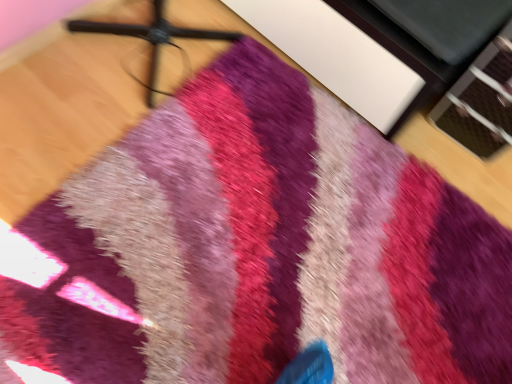
Question: Choose the correct answer: Is white matte cabinet at upper center inside black plastic tripod at upper center or outside it?

Choices:
 (A) inside
 (B) outside

Answer: (B)

Question: From a real-world perspective, relative to black plastic tripod at upper center, is white matte cabinet at upper center vertically above or below?

Choices:
 (A) above
 (B) below

Answer: (B)

Question: Would you say white matte cabinet at upper center is to the left or to the right of black plastic tripod at upper center in the picture?

Choices:
 (A) left
 (B) right

Answer: (B)

Question: In terms of height, does black plastic tripod at upper center look taller or shorter compared to white matte cabinet at upper center?

Choices:
 (A) short
 (B) tall

Answer: (B)

Question: Relative to white matte cabinet at upper center, is black plastic tripod at upper center in front or behind?

Choices:
 (A) front
 (B) behind

Answer: (A)

Question: From a real-world perspective, relative to white matte cabinet at upper center, is black plastic tripod at upper center vertically above or below?

Choices:
 (A) above
 (B) below

Answer: (A)

Question: In terms of width, does black plastic tripod at upper center look wider or thinner when compared to white matte cabinet at upper center?

Choices:
 (A) thin
 (B) wide

Answer: (A)